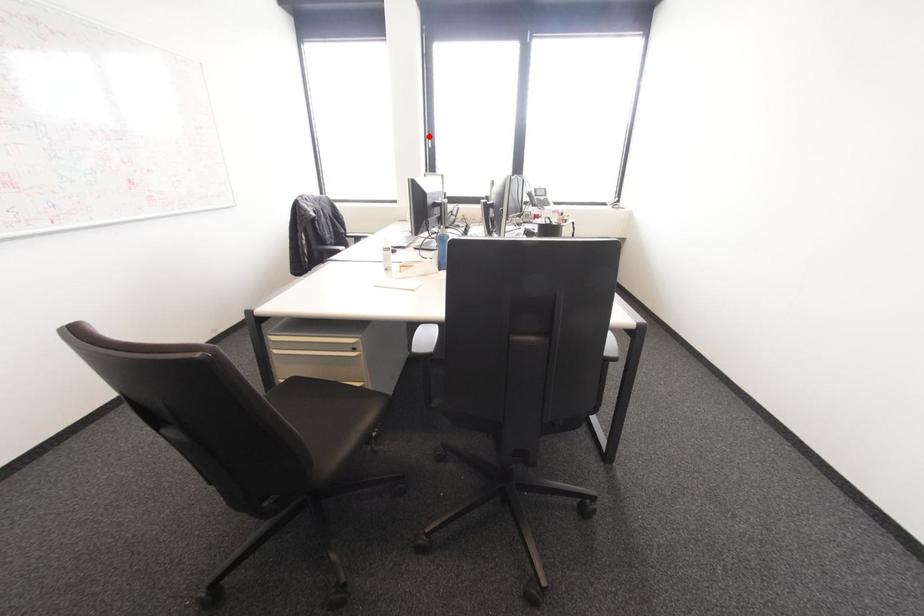
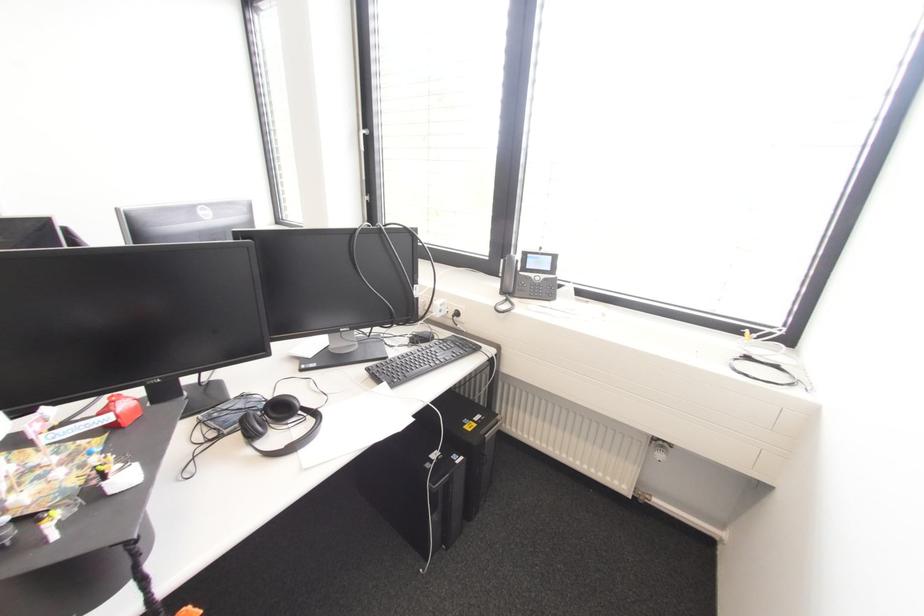
Question: A red point is marked in image1. In image2, is the corresponding 3D point closer to the camera or farther? Reply with the corresponding letter.

Choices:
 (A) The corresponding 3D point is closer.
 (B) The corresponding 3D point is farther.

Answer: (B)